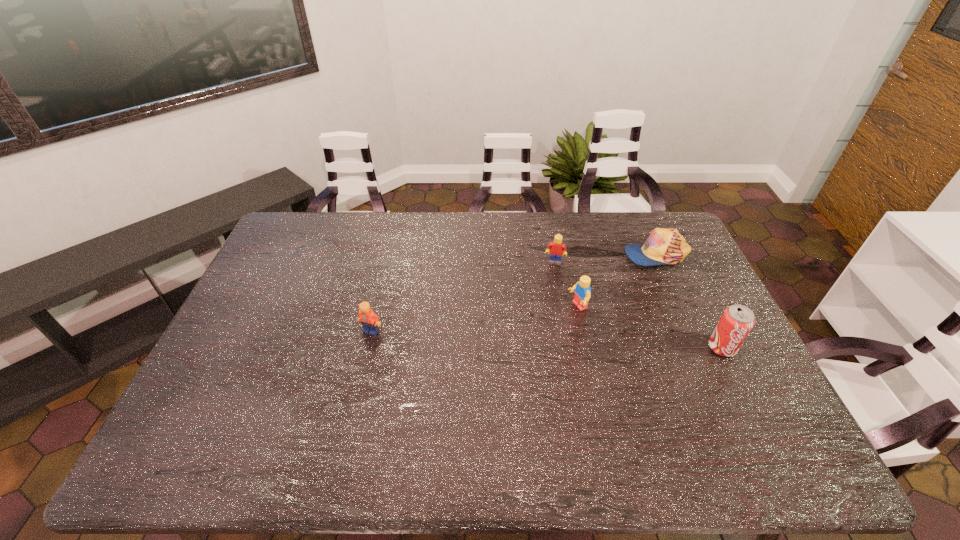
Find the location of a particular element. cap positioned at the right edge is located at coordinates (664, 246).

The image size is (960, 540). I want to click on object located at the far right corner, so click(664, 246).

The image size is (960, 540). I want to click on vacant space at the far edge of the desktop, so click(x=429, y=225).

Identify the location of vacant space at the near edge of the desktop. The height and width of the screenshot is (540, 960). (694, 406).

Where is `free space at the left edge`? free space at the left edge is located at coordinates (301, 259).

The width and height of the screenshot is (960, 540). What are the coordinates of `vacant space at the near left corner` in the screenshot? It's located at (228, 402).

You are a GUI agent. You are given a task and a screenshot of the screen. Output one action in this format:
    pyautogui.click(x=<x>, y=<y>)
    Task: Click on the vacant area between the second farthest Lego and the farthest Lego
    Image resolution: width=960 pixels, height=540 pixels.
    Given the screenshot: What is the action you would take?
    pyautogui.click(x=566, y=285)

You are a GUI agent. You are given a task and a screenshot of the screen. Output one action in this format:
    pyautogui.click(x=<x>, y=<y>)
    Task: Click on the vacant area that lies between the nearest Lego and the tallest object
    
    Given the screenshot: What is the action you would take?
    pyautogui.click(x=546, y=339)

The width and height of the screenshot is (960, 540). I want to click on blank region between the shortest object and the leftmost Lego, so click(514, 293).

In order to click on unoccupied area between the second farthest Lego and the cap in this screenshot , I will do `click(616, 281)`.